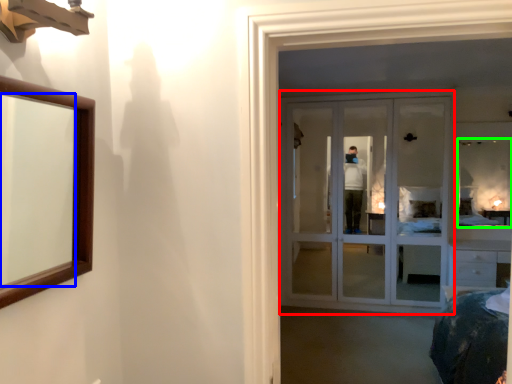
Question: Which object is positioned closest to door (highlighted by a red box)? Select from mirror (highlighted by a blue box) and mirror (highlighted by a green box).

Choices:
 (A) mirror
 (B) mirror

Answer: (B)